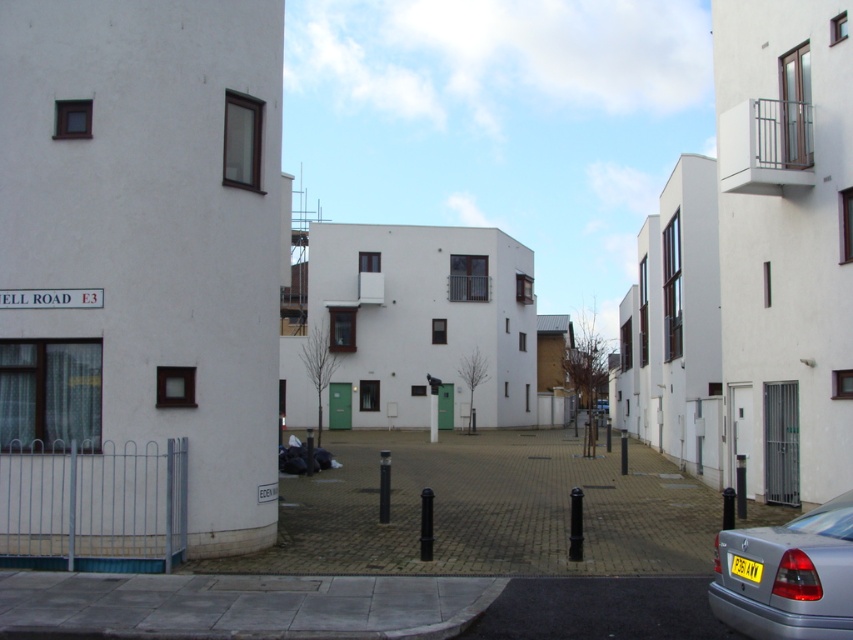
You are a delivery person trying to park a 4.5 meter long truck in the space between the silver metallic car at lower right and the black bollards. Can you fit the truck in that space?

The space between the silver metallic car at lower right and the black bollards is 5.17 meters, which is wider than the truck length of 4.5 meters. Yes, the truck can fit in that space.

You are a parking attendant checking the parking area. You see the silver metallic car at lower right and the yellow plastic license plate at lower right. Which object is nearer to you?

The silver metallic car at lower right is closer to the viewer than the yellow plastic license plate at lower right, so the car is nearer.

You are a parking attendant checking the alignment of vehicles in the courtyard. You notice the silver metallic car at lower right and the yellow plastic license plate at lower right. Which object is positioned more to the right side of the image?

The silver metallic car at lower right is positioned more to the right side of the image compared to the yellow plastic license plate at lower right.